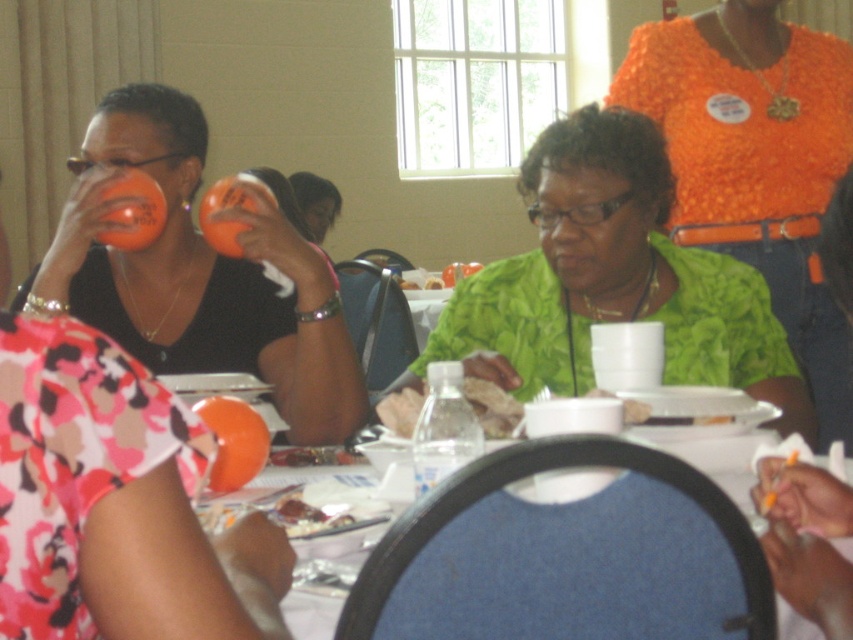
Who is lower down, green fabric shirt at center or matte orange cup at left?

green fabric shirt at center is lower down.

Who is positioned more to the right, green fabric shirt at center or matte orange cup at left?

green fabric shirt at center

Which is in front, point (637, 221) or point (125, 288)?

Point (637, 221) is more forward.

At what (x,y) coordinates should I click in order to perform the action: click on green fabric shirt at center. Please return your answer as a coordinate pair (x, y). Looking at the image, I should click on (611, 280).

Does matte orange cup at left have a lesser height compared to blue fabric chair at lower center?

In fact, matte orange cup at left may be taller than blue fabric chair at lower center.

Does matte orange cup at left have a lesser width compared to blue fabric chair at lower center?

Indeed, matte orange cup at left has a lesser width compared to blue fabric chair at lower center.

Between point (363, 413) and point (842, 524), which one is positioned in front?

Point (842, 524)

At what (x,y) coordinates should I click in order to perform the action: click on matte orange cup at left. Please return your answer as a coordinate pair (x, y). The image size is (853, 640). Looking at the image, I should click on (198, 273).

Is point (149, 248) positioned in front of point (294, 195)?

Yes, point (149, 248) is in front of point (294, 195).

This screenshot has width=853, height=640. Describe the element at coordinates (198, 273) in the screenshot. I see `matte orange cup at left` at that location.

Find the location of a particular element. Image resolution: width=853 pixels, height=640 pixels. matte orange cup at left is located at coordinates (198, 273).